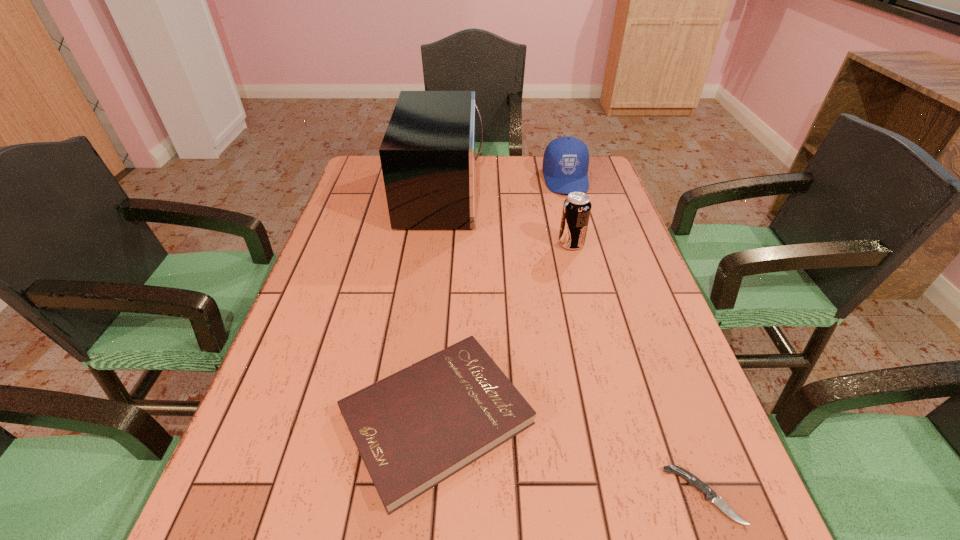
The width and height of the screenshot is (960, 540). Find the location of `microwave oven`. microwave oven is located at coordinates (428, 157).

At what (x,y) coordinates should I click in order to perform the action: click on the third farthest object. Please return your answer as a coordinate pair (x, y). Looking at the image, I should click on (576, 211).

The height and width of the screenshot is (540, 960). Find the location of `the third shortest object`. the third shortest object is located at coordinates (565, 165).

Image resolution: width=960 pixels, height=540 pixels. Identify the location of the fourth tallest object. (414, 429).

The image size is (960, 540). In order to click on pocketknife in this screenshot , I will do `click(710, 495)`.

I want to click on vacant space located 0.330m with the door open on the tallest object, so click(x=588, y=194).

You are a GUI agent. You are given a task and a screenshot of the screen. Output one action in this format:
    pyautogui.click(x=<x>, y=<y>)
    Task: Click on the vacant space positioned on the front of the soda can
    This screenshot has height=540, width=960.
    Given the screenshot: What is the action you would take?
    pyautogui.click(x=581, y=283)

Locate an element on the screen. The height and width of the screenshot is (540, 960). vacant space located 0.070m on the front-facing side of the third shortest object is located at coordinates (574, 210).

The height and width of the screenshot is (540, 960). I want to click on free location located 0.220m on the right of the hardback book, so (654, 417).

Find the location of a particular element. Image resolution: width=960 pixels, height=540 pixels. free space located 0.330m on the back of the pocketknife is located at coordinates (640, 322).